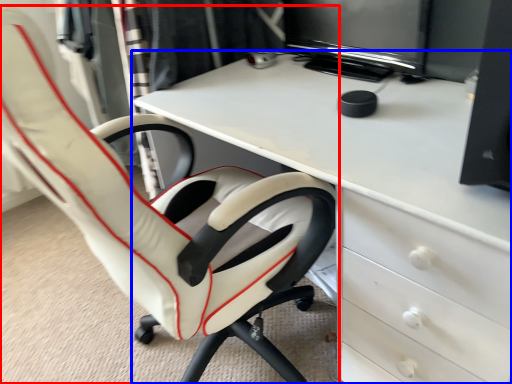
Question: Which object is further to the camera taking this photo, chair (highlighted by a red box) or desk (highlighted by a blue box)?

Choices:
 (A) chair
 (B) desk

Answer: (B)